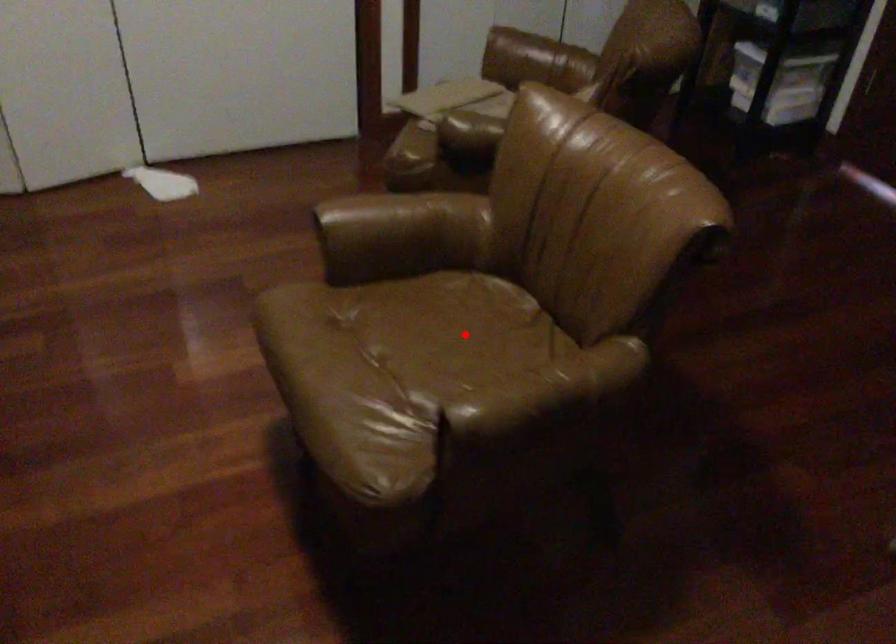
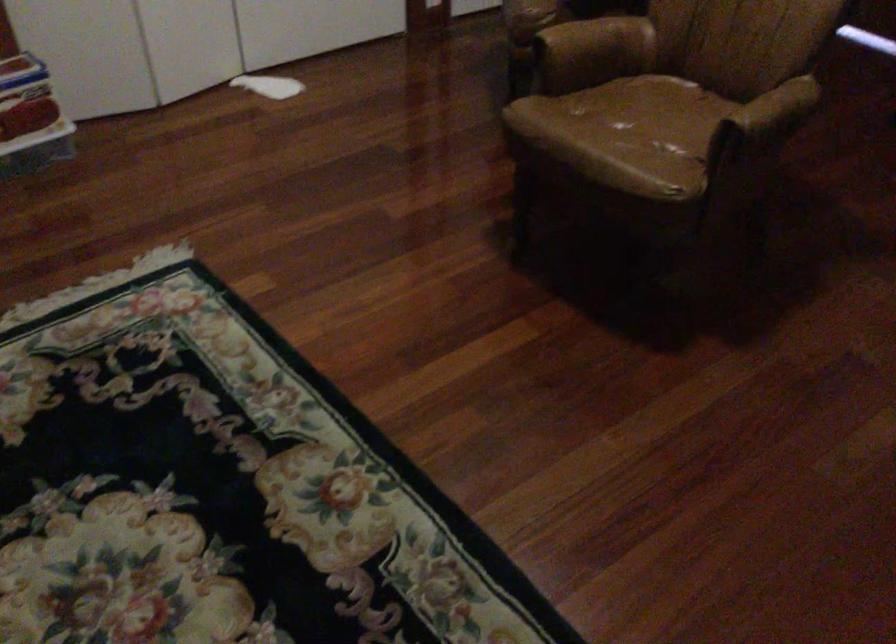
Question: I am providing you with two images of the same scene from different viewpoints. In image1, a red point is highlighted. Considering the same 3D point in image2, which of the following is correct?

Choices:
 (A) It is closer
 (B) It is farther

Answer: (B)